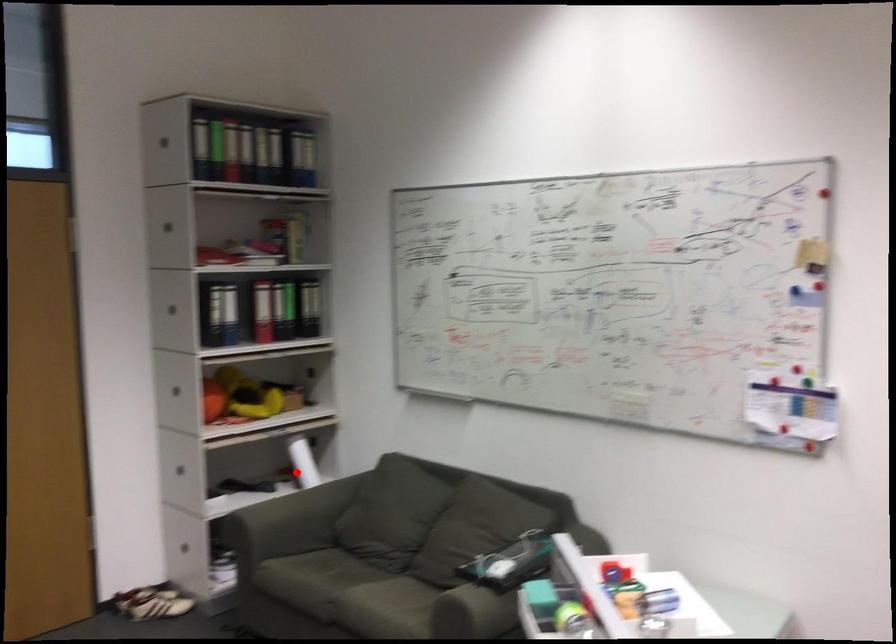
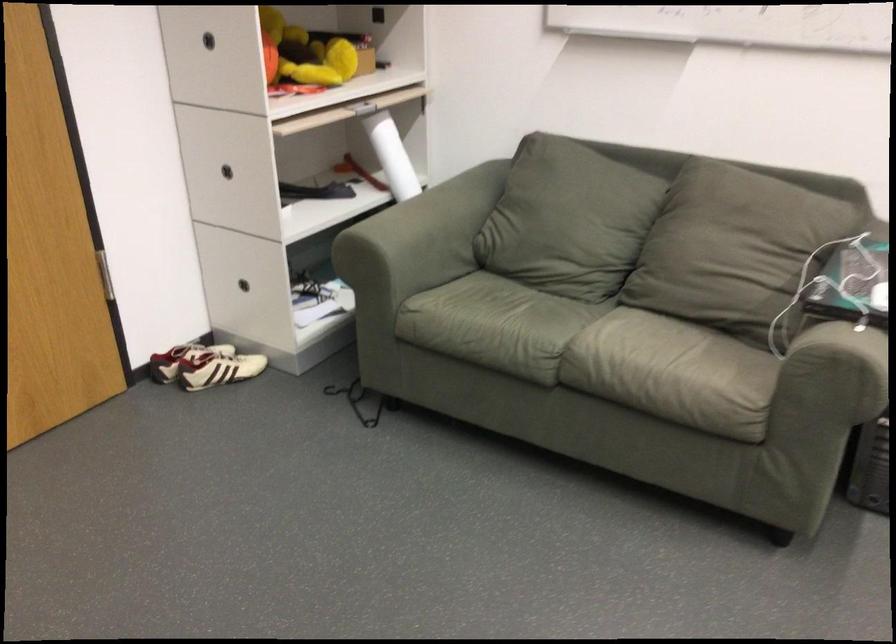
Where in the second image is the point corresponding to the highlighted location from the first image?

(392, 156)